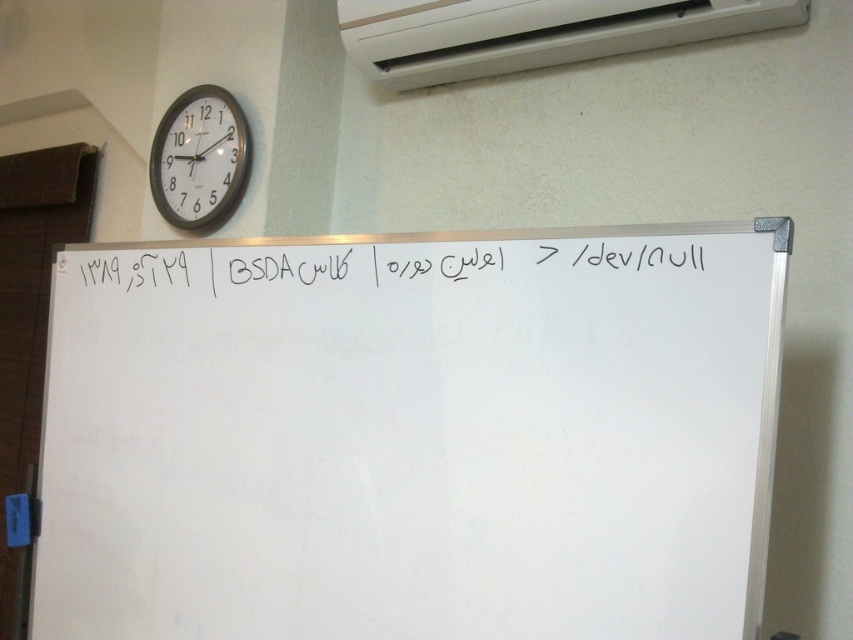
Question: In this image, where is white matte whiteboard at center located relative to black chalk writing at center?

Choices:
 (A) right
 (B) left

Answer: (A)

Question: Among these objects, which one is nearest to the camera?

Choices:
 (A) white matte whiteboard at center
 (B) white plastic air conditioning unit at upper center

Answer: (A)

Question: Does white plastic air conditioning unit at upper center have a lesser width compared to white plastic clock at upper left?

Choices:
 (A) yes
 (B) no

Answer: (B)

Question: Which of the following is the farthest from the observer?

Choices:
 (A) white plastic air conditioning unit at upper center
 (B) white matte whiteboard at center
 (C) black chalk writing at center

Answer: (A)

Question: Which point is closer to the camera?

Choices:
 (A) black chalk writing at center
 (B) white plastic clock at upper left

Answer: (A)

Question: Considering the relative positions of white plastic air conditioning unit at upper center and black chalk writing at center in the image provided, where is white plastic air conditioning unit at upper center located with respect to black chalk writing at center?

Choices:
 (A) left
 (B) right

Answer: (B)